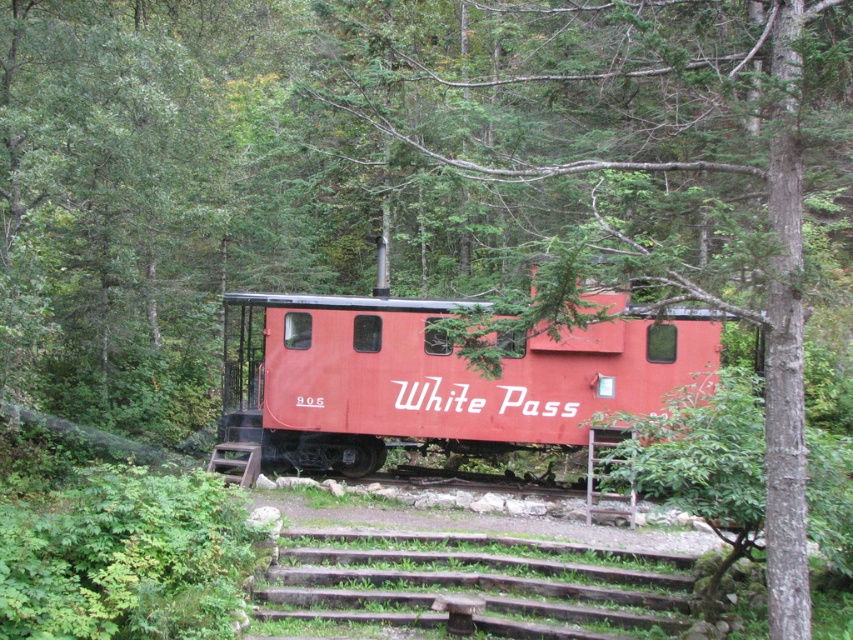
You are standing in the forest and see the green leafy tree at center and the matte red caboose at center. Which object is closer to you?

The green leafy tree at center is closer to you because it is in front of the matte red caboose at center.

You are standing in front of the caboose and want to take a photo of the matte red caboose at center without any obstruction. Given that the green leafy tree at center is blocking the view, can you determine if you can move to the side to avoid it?

The green leafy tree at center is much taller than the matte red caboose at center, so moving to the side might not be sufficient to avoid the obstruction since the tree is taller and may still block the view.

Consider the image. You are a painter standing in front of the image. You want to paint the scene so that the matte red caboose at center is fully visible without any obstruction from the green leafy tree at center. Should you move closer to or farther away from the scene?

The green leafy tree at center might be wider than the matte red caboose at center. To ensure the caboose is fully visible, you should move farther away from the scene. This will reduce the relative size of the tree compared to the caboose, minimizing obstruction.